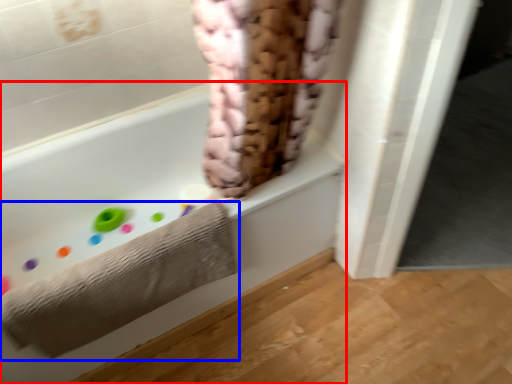
Question: Which of the following is the closest to the observer, bathtub (highlighted by a red box) or towel (highlighted by a blue box)?

Choices:
 (A) bathtub
 (B) towel

Answer: (A)